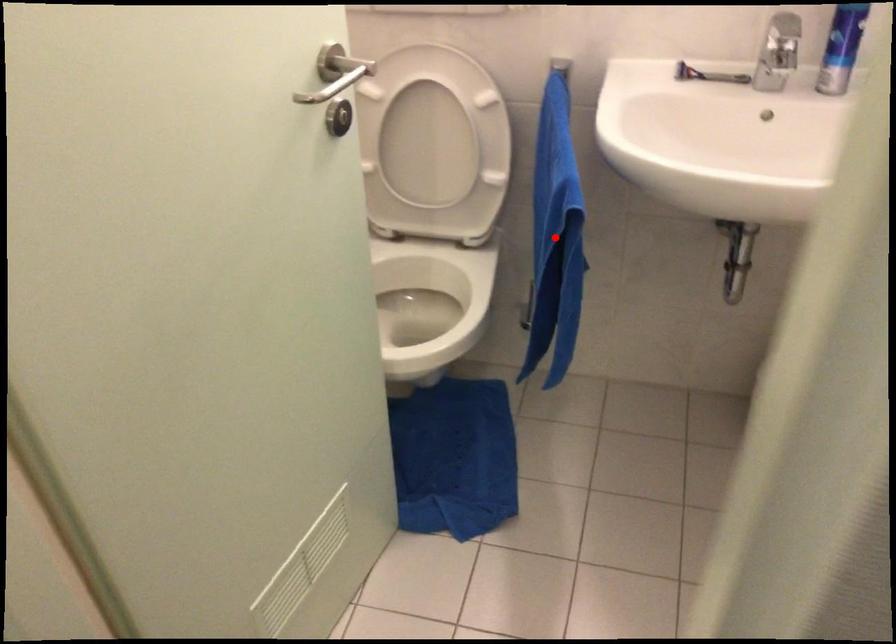
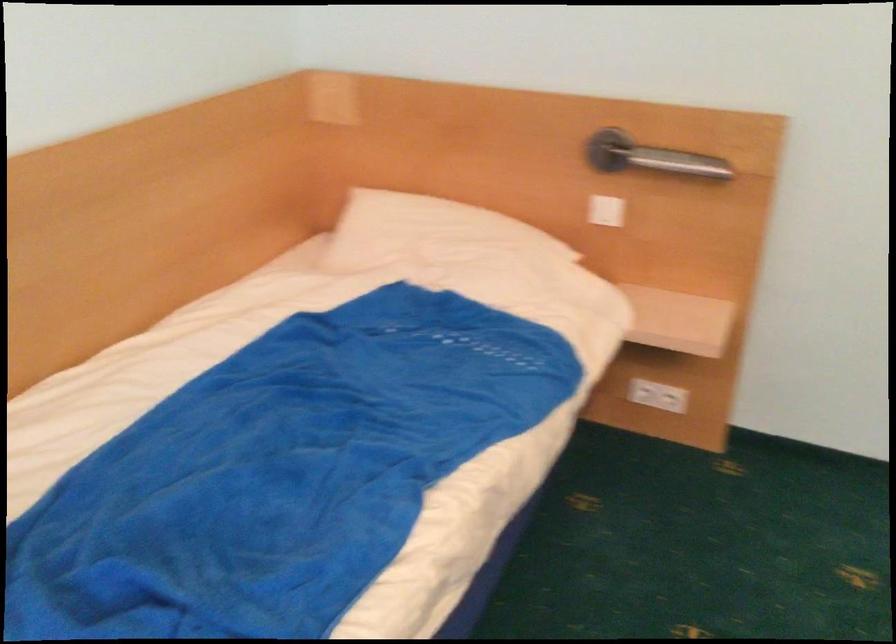
Question: I am providing you with two images of the same scene from different viewpoints. A red point is marked on the first image. Can you still see the location of the red point in image 2?

Choices:
 (A) Yes
 (B) No

Answer: (B)